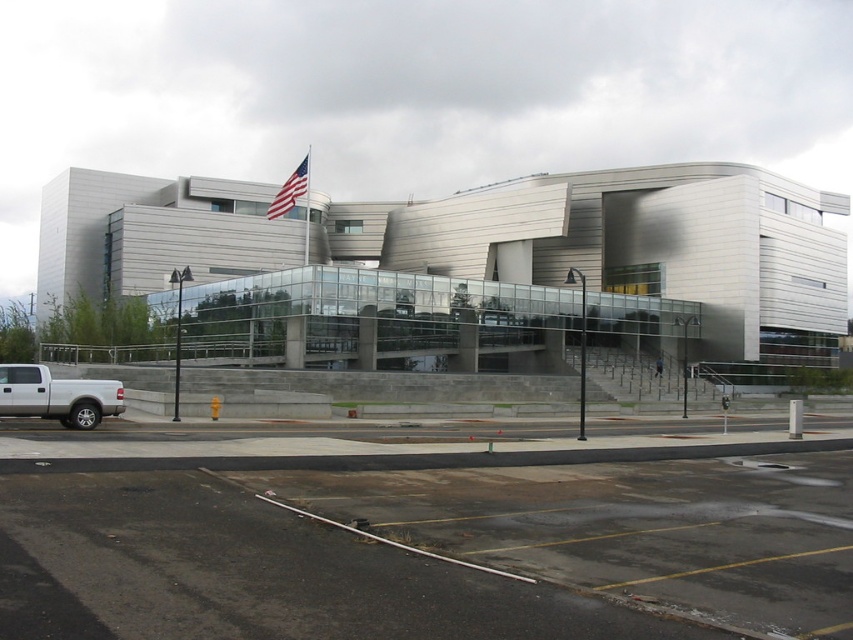
Which is behind, point (270, 598) or point (306, 160)?

The point (306, 160) is behind.

Who is positioned more to the right, dark asphalt parking lot at lower center or american flag at upper center?

Positioned to the right is dark asphalt parking lot at lower center.

What do you see at coordinates (428, 540) in the screenshot? This screenshot has width=853, height=640. I see `dark asphalt parking lot at lower center` at bounding box center [428, 540].

Identify the location of dark asphalt parking lot at lower center. Image resolution: width=853 pixels, height=640 pixels. (428, 540).

Is white matte truck at lower left thinner than american flag at upper center?

Indeed, white matte truck at lower left has a lesser width compared to american flag at upper center.

Who is higher up, white matte truck at lower left or american flag at upper center?

Positioned higher is american flag at upper center.

Who is more forward, (x=119, y=403) or (x=283, y=196)?

Point (x=119, y=403) is in front.

I want to click on white matte truck at lower left, so click(57, 396).

Is dark asphalt parking lot at lower center shorter than white matte truck at lower left?

No.

Between point (364, 515) and point (44, 416), which one is positioned behind?

Positioned behind is point (44, 416).

Where is `dark asphalt parking lot at lower center`? dark asphalt parking lot at lower center is located at coordinates (428, 540).